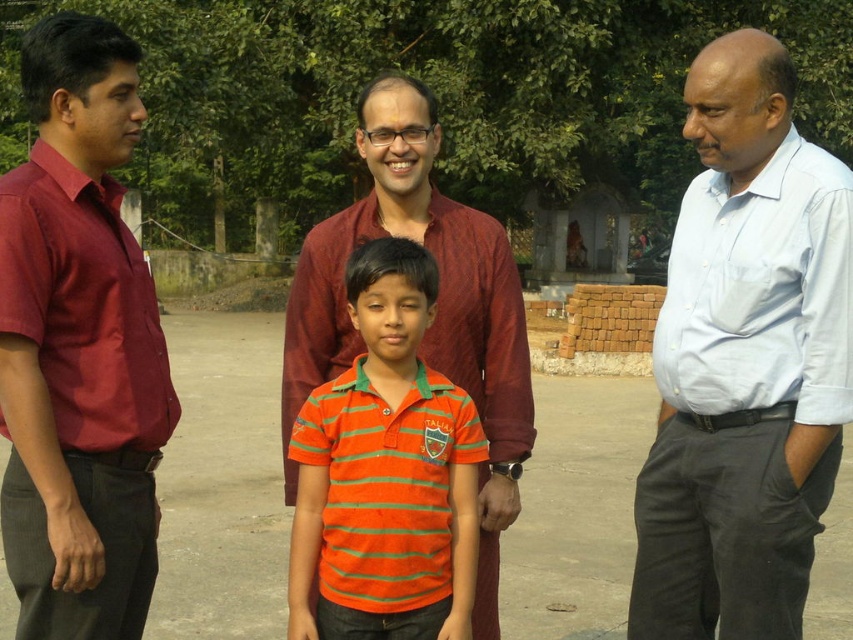
You are standing at point (370, 252) and want to walk to point (697, 244). Based on the scene, will you have to walk forward or backward?

You will have to walk forward to reach point (697, 244) because it is behind point (370, 252).

You are trying to locate the light blue shirt at right in the courtyard scene. Given the coordinates provided in the Objects Description, can you determine its position relative to the other individuals?

The light blue shirt at right is located at point (746, 362), which places it towards the right side of the image and closer to the bottom, making it the rightmost person among the group.